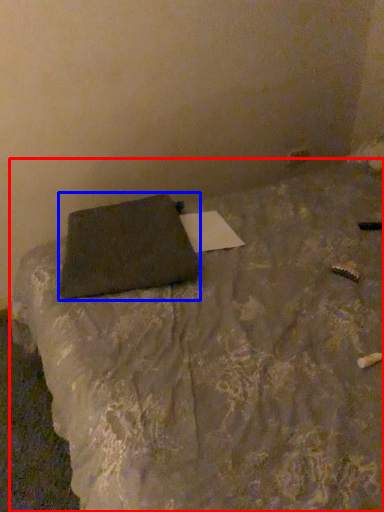
Question: Among these objects, which one is farthest to the camera, furniture (highlighted by a red box) or pillow (highlighted by a blue box)?

Choices:
 (A) furniture
 (B) pillow

Answer: (B)